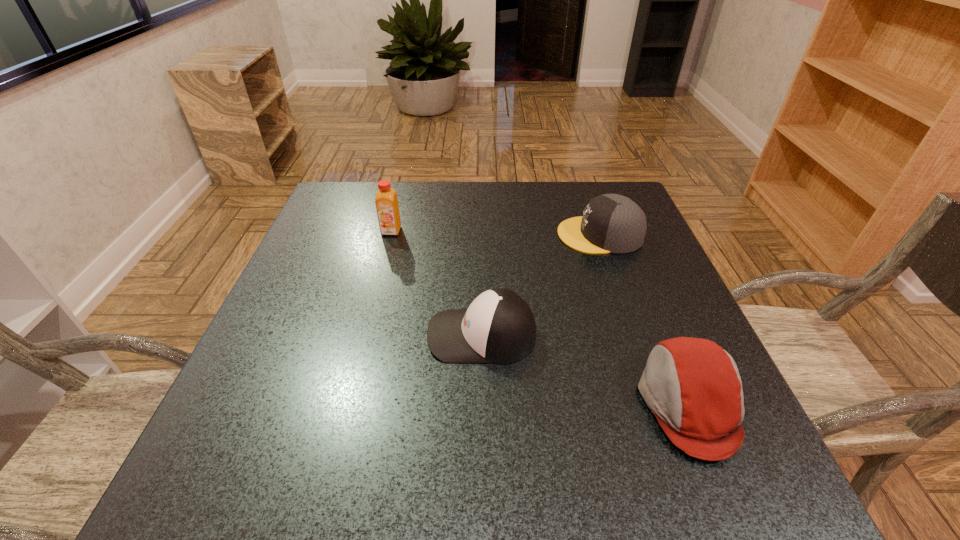
Where is `vacant point located between the second object from left to right and the farthest cap`? vacant point located between the second object from left to right and the farthest cap is located at coordinates (540, 285).

Identify which object is located as the second nearest to the orange juice. Please provide its 2D coordinates. Your answer should be formatted as a tuple, i.e. [(x, y)], where the tuple contains the x and y coordinates of a point satisfying the conditions above.

[(611, 223)]

Find the location of `object that is the third closest to the third object from right to left`. object that is the third closest to the third object from right to left is located at coordinates (386, 201).

Select which cap is the closest to the farthest cap. Please provide its 2D coordinates. Your answer should be formatted as a tuple, i.e. [(x, y)], where the tuple contains the x and y coordinates of a point satisfying the conditions above.

[(498, 327)]

At what (x,y) coordinates should I click in order to perform the action: click on the closest cap to the farthest cap. Please return your answer as a coordinate pair (x, y). The image size is (960, 540). Looking at the image, I should click on (498, 327).